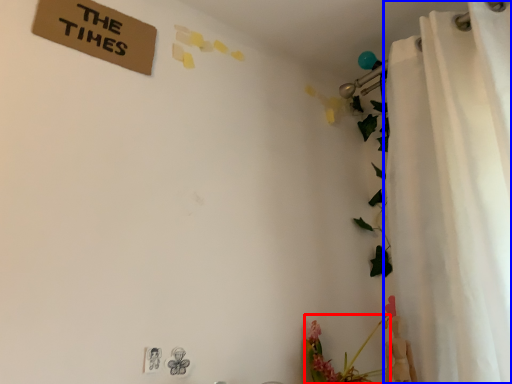
Question: Which point is closer to the camera, floral arrangement (highlighted by a red box) or curtain (highlighted by a blue box)?

Choices:
 (A) floral arrangement
 (B) curtain

Answer: (B)